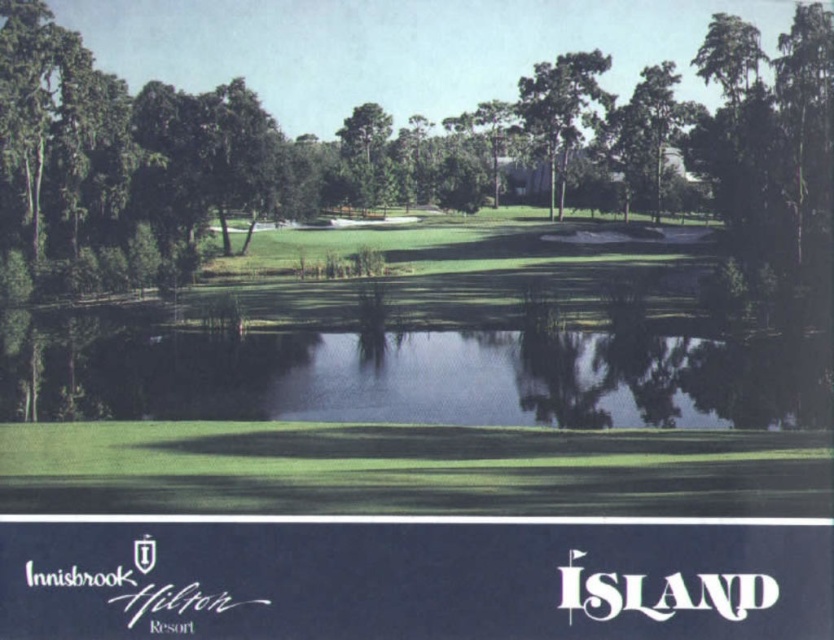
You are a golfer standing on the green golf course and see the green leafy tree at center and the green leafy tree at upper center. Which tree is closer to you?

The green leafy tree at center is closer to you because it is positioned under the green leafy tree at upper center, indicating it is in front.

You are a golfer standing at the tee box of the golf course. You want to hit your ball towards the green, but there is a sand bunker in the way. To avoid it, you decide to aim for the green leafy tree at center. Where exactly should you aim your shot? Please provide coordinates based on the image grid system.

You should aim your shot towards the coordinates point at (384,150), which is where the green leafy tree at center is located.